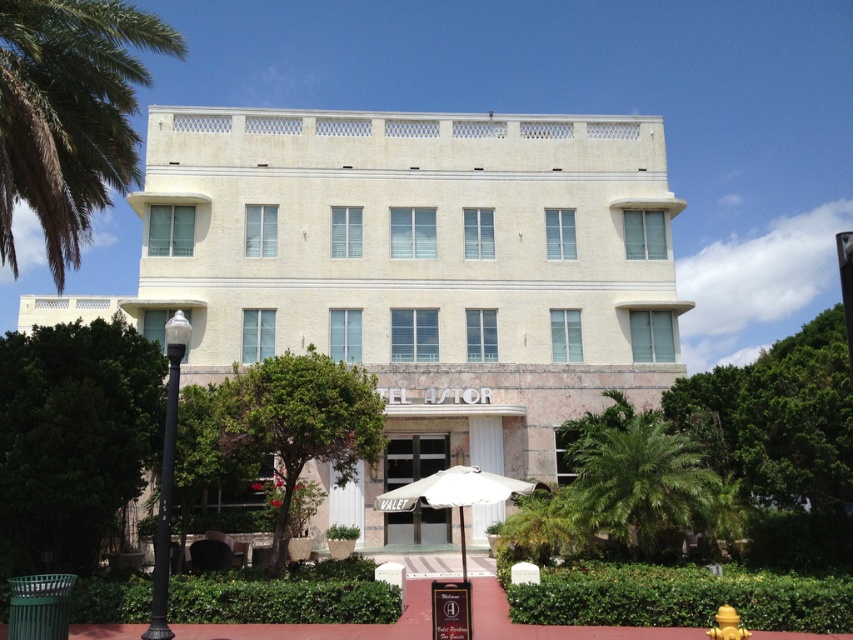
From the picture: Is green leafy palm tree at upper left wider than yellow matte hydrant at lower right?

Correct, the width of green leafy palm tree at upper left exceeds that of yellow matte hydrant at lower right.

Does green leafy palm tree at upper left lie in front of yellow matte hydrant at lower right?

No.

Which is in front, point (3, 140) or point (735, 616)?

Point (735, 616) is more forward.

In order to click on green leafy palm tree at upper left in this screenshot , I will do `click(68, 113)`.

Based on the photo, can you confirm if green leafy palm tree at lower right is wider than white fabric umbrella at center?

Incorrect, green leafy palm tree at lower right's width does not surpass white fabric umbrella at center's.

Can you confirm if green leafy palm tree at lower right is smaller than white fabric umbrella at center?

Correct, green leafy palm tree at lower right occupies less space than white fabric umbrella at center.

I want to click on green leafy palm tree at lower right, so 636,476.

Image resolution: width=853 pixels, height=640 pixels. Describe the element at coordinates (453, 493) in the screenshot. I see `white fabric umbrella at center` at that location.

Can you confirm if white fabric umbrella at center is shorter than yellow matte hydrant at lower right?

No.

Locate an element on the screen. Image resolution: width=853 pixels, height=640 pixels. white fabric umbrella at center is located at coordinates (453, 493).